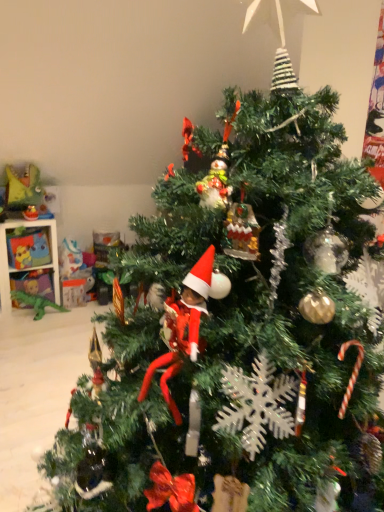
Question: Is green plastic dinosaur at left, the third toy in the top-to-bottom sequence, not inside matte yellow plush toy at left, which appears as the 1th toy when viewed from the top?

Choices:
 (A) no
 (B) yes

Answer: (B)

Question: From a real-world perspective, is green plastic dinosaur at left, the third toy in the top-to-bottom sequence, located higher than matte yellow plush toy at left, which appears as the 1th toy when viewed from the top?

Choices:
 (A) yes
 (B) no

Answer: (B)

Question: Considering the relative sizes of green plastic dinosaur at left, the third toy in the top-to-bottom sequence, and matte yellow plush toy at left, which appears as the 1th toy when viewed from the top, in the image provided, is green plastic dinosaur at left, the third toy in the top-to-bottom sequence, bigger than matte yellow plush toy at left, which appears as the 1th toy when viewed from the top,?

Choices:
 (A) yes
 (B) no

Answer: (B)

Question: Is green plastic dinosaur at left, the third toy in the top-to-bottom sequence, in contact with matte yellow plush toy at left, which appears as the 1th toy when viewed from the top?

Choices:
 (A) yes
 (B) no

Answer: (B)

Question: From a real-world perspective, is green plastic dinosaur at left, the third toy in the top-to-bottom sequence, positioned under matte yellow plush toy at left, the third toy when ordered from bottom to top, based on gravity?

Choices:
 (A) yes
 (B) no

Answer: (A)

Question: From a real-world perspective, relative to matte plastic toy at left, is green plastic dinosaur at left, the third toy in the top-to-bottom sequence, vertically above or below?

Choices:
 (A) below
 (B) above

Answer: (A)

Question: Is green plastic dinosaur at left, marked as the 1th toy in a bottom-to-top arrangement, taller or shorter than matte plastic toy at left?

Choices:
 (A) tall
 (B) short

Answer: (B)

Question: Is green plastic dinosaur at left, marked as the 1th toy in a bottom-to-top arrangement, wider or thinner than matte plastic toy at left?

Choices:
 (A) thin
 (B) wide

Answer: (A)

Question: Is green plastic dinosaur at left, marked as the 1th toy in a bottom-to-top arrangement, situated inside matte plastic toy at left or outside?

Choices:
 (A) outside
 (B) inside

Answer: (A)

Question: Is matte yellow toy at upper left, placed as the 2th toy when sorted from top to bottom, inside or outside of matte yellow plush toy at left, the third toy when ordered from bottom to top?

Choices:
 (A) outside
 (B) inside

Answer: (B)

Question: Considering the positions of point (26, 212) and point (11, 166), is point (26, 212) closer or farther from the camera than point (11, 166)?

Choices:
 (A) farther
 (B) closer

Answer: (B)

Question: From a real-world perspective, relative to matte yellow plush toy at left, which appears as the 1th toy when viewed from the top, is matte yellow toy at upper left, placed as the 2th toy when sorted from top to bottom, vertically above or below?

Choices:
 (A) below
 (B) above

Answer: (A)

Question: Based on their sizes in the image, would you say matte yellow toy at upper left, placed as the 2th toy when sorted from top to bottom, is bigger or smaller than matte yellow plush toy at left, the third toy when ordered from bottom to top?

Choices:
 (A) small
 (B) big

Answer: (A)

Question: Is matte yellow toy at upper left, arranged as the 2th toy when ordered from the bottom, taller or shorter than green plastic dinosaur at left, the third toy in the top-to-bottom sequence?

Choices:
 (A) short
 (B) tall

Answer: (A)

Question: In the image, is matte yellow toy at upper left, arranged as the 2th toy when ordered from the bottom, positioned in front of or behind green plastic dinosaur at left, the third toy in the top-to-bottom sequence?

Choices:
 (A) behind
 (B) front

Answer: (A)